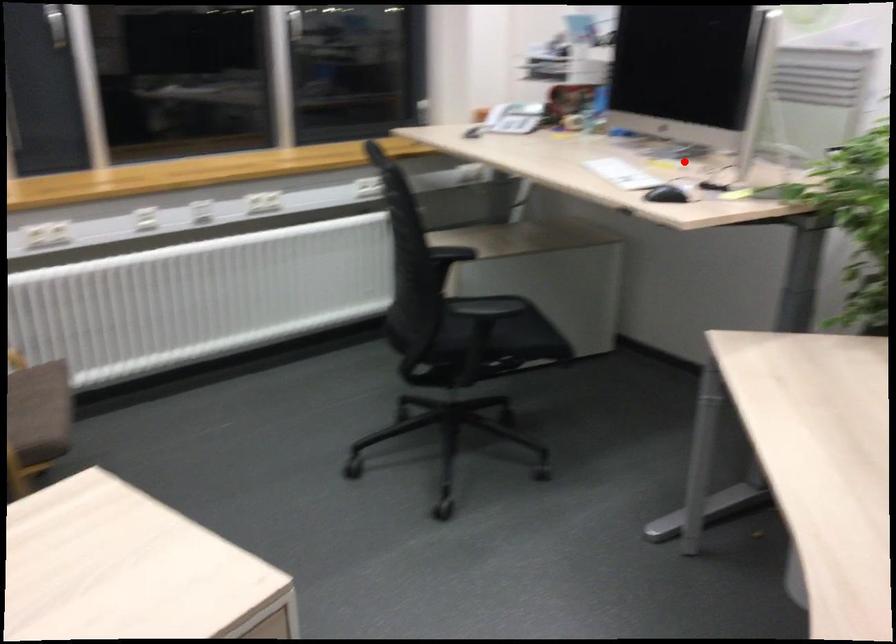
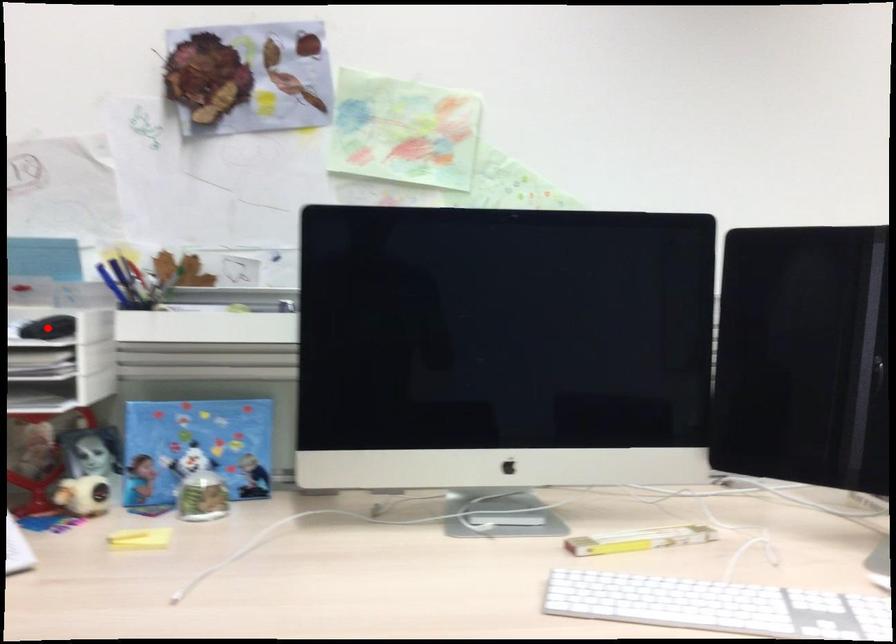
I am providing you with two images of the same scene from different viewpoints. A red point is marked on the first image and another point is marked on the second image. Do the highlighted points in image1 and image2 indicate the same real-world spot?

No